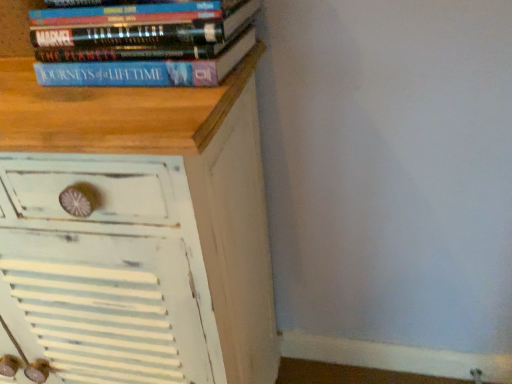
Identify the location of blue matte book at upper left. (144, 52).

This screenshot has height=384, width=512. What do you see at coordinates (144, 52) in the screenshot?
I see `blue matte book at upper left` at bounding box center [144, 52].

Locate an element on the screen. white distressed wood chest of drawers at upper left is located at coordinates (137, 231).

The width and height of the screenshot is (512, 384). What do you see at coordinates (137, 231) in the screenshot?
I see `white distressed wood chest of drawers at upper left` at bounding box center [137, 231].

Identify the location of blue matte book at upper left. (144, 52).

Looking at this image, based on their positions, is white distressed wood chest of drawers at upper left located to the left or right of blue matte book at upper left?

In the image, white distressed wood chest of drawers at upper left appears on the left side of blue matte book at upper left.

Does white distressed wood chest of drawers at upper left come behind blue matte book at upper left?

No, white distressed wood chest of drawers at upper left is closer to the viewer.

Considering the points (87, 344) and (206, 54), which point is behind, point (87, 344) or point (206, 54)?

Point (87, 344)

From the image's perspective, which one is positioned higher, white distressed wood chest of drawers at upper left or blue matte book at upper left?

blue matte book at upper left appears higher in the image.

From a real-world perspective, does white distressed wood chest of drawers at upper left sit lower than blue matte book at upper left?

Yes, from a real-world perspective, white distressed wood chest of drawers at upper left is under blue matte book at upper left.

Does white distressed wood chest of drawers at upper left have a greater width compared to blue matte book at upper left?

Indeed, white distressed wood chest of drawers at upper left has a greater width compared to blue matte book at upper left.

Is white distressed wood chest of drawers at upper left shorter than blue matte book at upper left?

Incorrect, the height of white distressed wood chest of drawers at upper left does not fall short of that of blue matte book at upper left.

Based on their sizes in the image, would you say white distressed wood chest of drawers at upper left is bigger or smaller than blue matte book at upper left?

In the image, white distressed wood chest of drawers at upper left appears to be larger than blue matte book at upper left.

Is white distressed wood chest of drawers at upper left spatially inside blue matte book at upper left, or outside of it?

The correct answer is: outside.

Is white distressed wood chest of drawers at upper left next to blue matte book at upper left and touching it?

white distressed wood chest of drawers at upper left and blue matte book at upper left are not in contact.

Could you tell me if white distressed wood chest of drawers at upper left is turned towards blue matte book at upper left?

No, white distressed wood chest of drawers at upper left is not turned towards blue matte book at upper left.

Measure the distance between white distressed wood chest of drawers at upper left and blue matte book at upper left.

They are 8.51 inches apart.

Image resolution: width=512 pixels, height=384 pixels. I want to click on the chest of drawers beneath the blue matte book at upper left (from a real-world perspective), so click(x=137, y=231).

Would you say blue matte book at upper left is to the left or to the right of white distressed wood chest of drawers at upper left in the picture?

In the image, blue matte book at upper left appears on the right side of white distressed wood chest of drawers at upper left.

Who is more distant, blue matte book at upper left or white distressed wood chest of drawers at upper left?

blue matte book at upper left is more distant.

Does point (205, 38) lie in front of point (67, 219)?

Yes.

Based on the photo, from the image's perspective, is blue matte book at upper left on top of white distressed wood chest of drawers at upper left?

Yes, from the image's perspective, blue matte book at upper left is on top of white distressed wood chest of drawers at upper left.

From a real-world perspective, who is located lower, blue matte book at upper left or white distressed wood chest of drawers at upper left?

white distressed wood chest of drawers at upper left is physically lower.

In terms of width, does blue matte book at upper left look wider or thinner when compared to white distressed wood chest of drawers at upper left?

Clearly, blue matte book at upper left has less width compared to white distressed wood chest of drawers at upper left.

Considering the relative sizes of blue matte book at upper left and white distressed wood chest of drawers at upper left in the image provided, is blue matte book at upper left shorter than white distressed wood chest of drawers at upper left?

Correct, blue matte book at upper left is not as tall as white distressed wood chest of drawers at upper left.

In terms of size, does blue matte book at upper left appear bigger or smaller than white distressed wood chest of drawers at upper left?

Clearly, blue matte book at upper left is smaller in size than white distressed wood chest of drawers at upper left.

Is blue matte book at upper left not inside white distressed wood chest of drawers at upper left?

That's correct, blue matte book at upper left is outside of white distressed wood chest of drawers at upper left.

Is blue matte book at upper left next to white distressed wood chest of drawers at upper left and touching it?

No.

Is blue matte book at upper left positioned with its back to white distressed wood chest of drawers at upper left?

→ No, blue matte book at upper left's orientation is not away from white distressed wood chest of drawers at upper left.

Measure the distance between blue matte book at upper left and white distressed wood chest of drawers at upper left.

The distance of blue matte book at upper left from white distressed wood chest of drawers at upper left is 8.51 inches.

Where is `book behind the white distressed wood chest of drawers at upper left`? The width and height of the screenshot is (512, 384). book behind the white distressed wood chest of drawers at upper left is located at coordinates (144, 52).

Locate an element on the screen. the chest of drawers that is below the blue matte book at upper left (from the image's perspective) is located at coordinates (137, 231).

At what (x,y) coordinates should I click in order to perform the action: click on the chest of drawers below the blue matte book at upper left (from a real-world perspective). Please return your answer as a coordinate pair (x, y). The height and width of the screenshot is (384, 512). Looking at the image, I should click on (137, 231).